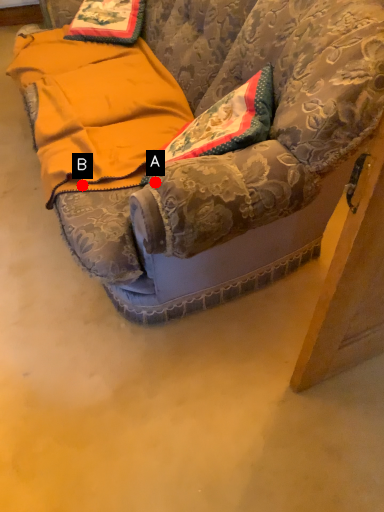
Question: Two points are circled on the image, labeled by A and B beside each circle. Among these points, which one is nearest to the camera?

Choices:
 (A) A is closer
 (B) B is closer

Answer: (A)